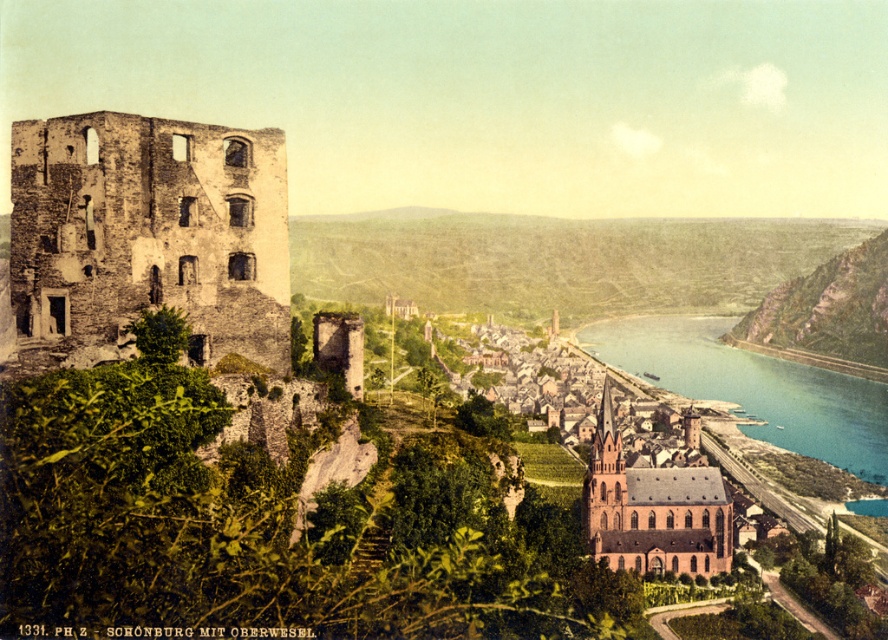
Which is above, blue water at river right or brown stone church at center?

Positioned higher is blue water at river right.

Does blue water at river right appear on the right side of brown stone church at center?

Correct, you'll find blue water at river right to the right of brown stone church at center.

This screenshot has width=888, height=640. I want to click on blue water at river right, so tap(754, 387).